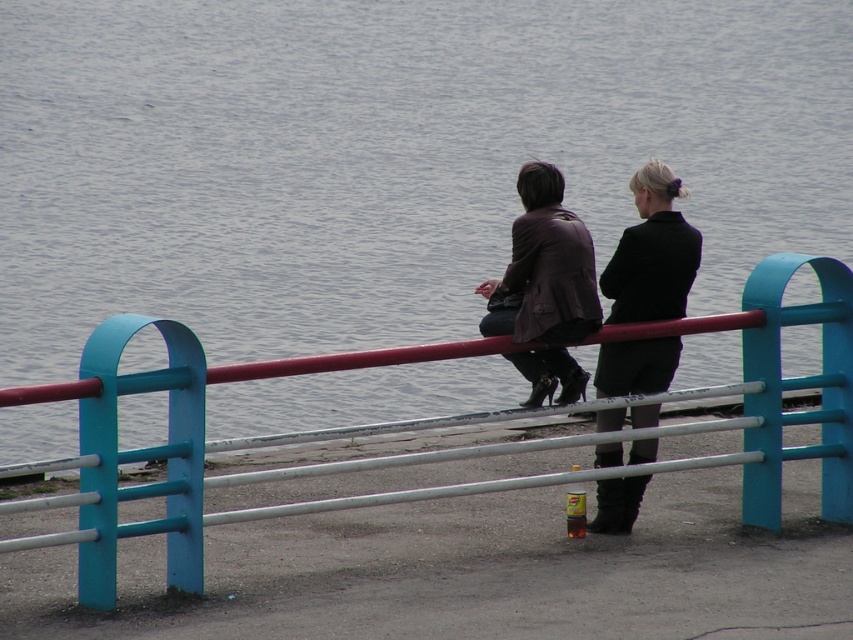
Can you confirm if teal plastic fence at lower center is positioned to the right of brown leather jacket at upper center?

In fact, teal plastic fence at lower center is to the left of brown leather jacket at upper center.

Does teal plastic fence at lower center appear on the left side of brown leather jacket at upper center?

Yes, teal plastic fence at lower center is to the left of brown leather jacket at upper center.

Who is more distant from viewer, (148,484) or (543,356)?

Positioned behind is point (543,356).

At what (x,y) coordinates should I click in order to perform the action: click on teal plastic fence at lower center. Please return your answer as a coordinate pair (x, y). Looking at the image, I should click on (439, 451).

Between teal plastic fence at lower center and black leather coat at center, which one has less height?

Standing shorter between the two is teal plastic fence at lower center.

Who is lower down, teal plastic fence at lower center or black leather coat at center?

teal plastic fence at lower center is lower down.

Which is behind, point (201, 364) or point (628, 307)?

Positioned behind is point (628, 307).

Where is `teal plastic fence at lower center`? teal plastic fence at lower center is located at coordinates (439, 451).

Does gray water at upper center appear on the left side of teal plastic fence at lower center?

Yes, gray water at upper center is to the left of teal plastic fence at lower center.

Identify the location of gray water at upper center. The width and height of the screenshot is (853, 640). (386, 157).

Locate an element on the screen. This screenshot has width=853, height=640. gray water at upper center is located at coordinates (386, 157).